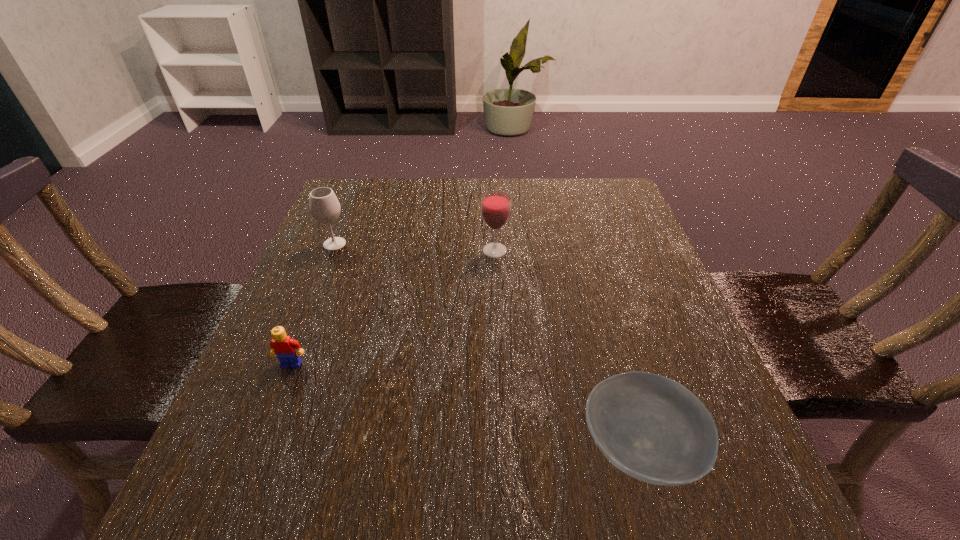
Where is `the right wineglass`? The image size is (960, 540). the right wineglass is located at coordinates (495, 205).

Identify the location of the left wineglass. (324, 206).

Find the location of `the third farthest object`. the third farthest object is located at coordinates (283, 346).

In order to click on the shortest object in this screenshot , I will do `click(652, 428)`.

Where is `the nearest object`? the nearest object is located at coordinates click(652, 428).

Locate an element on the screen. free location located 0.110m on the left of the right wineglass is located at coordinates (433, 251).

Locate an element on the screen. The image size is (960, 540). free space located on the back of the left wineglass is located at coordinates (349, 209).

You are a GUI agent. You are given a task and a screenshot of the screen. Output one action in this format:
    pyautogui.click(x=<x>, y=<y>)
    Task: Click on the vacant space located on the face of the third farthest object
    The image size is (960, 540).
    Given the screenshot: What is the action you would take?
    pyautogui.click(x=271, y=415)

This screenshot has width=960, height=540. Identify the location of free space located on the left of the shortest object. (478, 448).

Identify the location of object at the near edge. (652, 428).